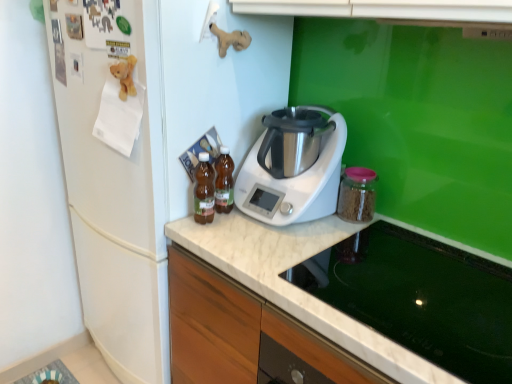
Question: Is transparent glass jar at right, which is the first kitchen appliance in right-to-left order, turned away from brown glass bottles at center, arranged as the 4th kitchen appliance when viewed from the right?

Choices:
 (A) no
 (B) yes

Answer: (A)

Question: Does transparent glass jar at right, the 4th kitchen appliance in the left-to-right sequence, come in front of brown glass bottles at center, which is the 1th kitchen appliance in left-to-right order?

Choices:
 (A) yes
 (B) no

Answer: (B)

Question: From the image's perspective, would you say transparent glass jar at right, the 4th kitchen appliance in the left-to-right sequence, is positioned over brown glass bottles at center, arranged as the 4th kitchen appliance when viewed from the right?

Choices:
 (A) yes
 (B) no

Answer: (B)

Question: Could you tell me if transparent glass jar at right, which is the first kitchen appliance in right-to-left order, is facing brown glass bottles at center, arranged as the 4th kitchen appliance when viewed from the right?

Choices:
 (A) yes
 (B) no

Answer: (B)

Question: Considering the relative sizes of transparent glass jar at right, the 4th kitchen appliance in the left-to-right sequence, and brown glass bottles at center, arranged as the 4th kitchen appliance when viewed from the right, in the image provided, is transparent glass jar at right, the 4th kitchen appliance in the left-to-right sequence, smaller than brown glass bottles at center, arranged as the 4th kitchen appliance when viewed from the right,?

Choices:
 (A) yes
 (B) no

Answer: (B)

Question: Does transparent glass jar at right, which is the first kitchen appliance in right-to-left order, have a larger size compared to brown glass bottles at center, arranged as the 4th kitchen appliance when viewed from the right?

Choices:
 (A) yes
 (B) no

Answer: (A)

Question: Is glass stovetop at lower center far from translucent glass bottles at center, acting as the 2th kitchen appliance starting from the left?

Choices:
 (A) yes
 (B) no

Answer: (B)

Question: Is glass stovetop at lower center positioned with its back to translucent glass bottles at center, placed as the 3th kitchen appliance when sorted from right to left?

Choices:
 (A) no
 (B) yes

Answer: (A)

Question: Considering the relative sizes of glass stovetop at lower center and translucent glass bottles at center, acting as the 2th kitchen appliance starting from the left, in the image provided, is glass stovetop at lower center taller than translucent glass bottles at center, acting as the 2th kitchen appliance starting from the left,?

Choices:
 (A) no
 (B) yes

Answer: (A)

Question: Is glass stovetop at lower center aimed at translucent glass bottles at center, acting as the 2th kitchen appliance starting from the left?

Choices:
 (A) yes
 (B) no

Answer: (B)

Question: Is glass stovetop at lower center with translucent glass bottles at center, placed as the 3th kitchen appliance when sorted from right to left?

Choices:
 (A) yes
 (B) no

Answer: (B)

Question: From the image's perspective, is glass stovetop at lower center on top of translucent glass bottles at center, acting as the 2th kitchen appliance starting from the left?

Choices:
 (A) yes
 (B) no

Answer: (B)

Question: Is transparent glass jar at right, the 4th kitchen appliance in the left-to-right sequence, thinner than white matte refrigerator at left?

Choices:
 (A) no
 (B) yes

Answer: (B)